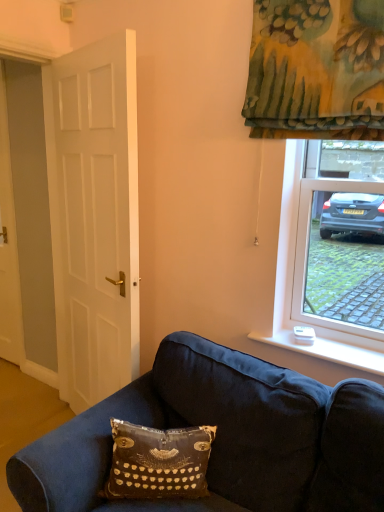
Find the location of a particular element. This screenshot has width=384, height=512. white wood door at left, the first door when ordered from left to right is located at coordinates (8, 246).

The height and width of the screenshot is (512, 384). I want to click on white matte door at left, which appears as the 2th door when viewed from the back, so click(x=94, y=216).

In order to click on velvety black pillow with typewriter design at lower center in this screenshot , I will do `click(158, 462)`.

The width and height of the screenshot is (384, 512). In order to click on white wood door at left, marked as the 2th door in a right-to-left arrangement in this screenshot , I will do `click(8, 246)`.

Considering the relative sizes of white wood door at left, the first door when ordered from left to right, and white matte door at left, the 1th door positioned from the front, in the image provided, is white wood door at left, the first door when ordered from left to right, shorter than white matte door at left, the 1th door positioned from the front,?

Indeed, white wood door at left, the first door when ordered from left to right, has a lesser height compared to white matte door at left, the 1th door positioned from the front.

Based on the photo, does white wood door at left, the first door when ordered from left to right, touch white matte door at left, positioned as the first door in right-to-left order?

No.

Is white wood door at left, the first door when ordered from left to right, to the left or to the right of white matte door at left, the 1th door positioned from the front, in the image?

white wood door at left, the first door when ordered from left to right, is positioned on white matte door at left, the 1th door positioned from the front,'s left side.

What's the angular difference between white wood door at left, the 1th door viewed from the back, and white matte door at left, positioned as the first door in right-to-left order,'s facing directions?

The angle between the facing direction of white wood door at left, the 1th door viewed from the back, and the facing direction of white matte door at left, positioned as the first door in right-to-left order, is 15.2 degrees.

Is white plastic remote control at lower right to the left of white matte door at left, the 1th door positioned from the front, from the viewer's perspective?

No.

Would you say white plastic remote control at lower right contains white matte door at left, positioned as the first door in right-to-left order?

Actually, white matte door at left, positioned as the first door in right-to-left order, is outside white plastic remote control at lower right.

From a real-world perspective, is white plastic remote control at lower right beneath white matte door at left, the 2th door positioned from the left?

Yes, from a real-world perspective, white plastic remote control at lower right is under white matte door at left, the 2th door positioned from the left.

Does white matte door at left, the 2th door positioned from the left, contain white plastic remote control at lower right?

No.

From the image's perspective, which is below, white matte door at left, the 2th door positioned from the left, or white plastic remote control at lower right?

white plastic remote control at lower right.

Who is shorter, white matte door at left, the 2th door positioned from the left, or white plastic remote control at lower right?

With less height is white plastic remote control at lower right.

Where is `window sill below the white matte door at left, the 1th door positioned from the front (from the image's perspective)`? window sill below the white matte door at left, the 1th door positioned from the front (from the image's perspective) is located at coordinates (327, 350).

How different are the orientations of white wood door at left, marked as the 2th door in a right-to-left arrangement, and white plastic remote control at lower right in degrees?

2.55 degrees separate the facing orientations of white wood door at left, marked as the 2th door in a right-to-left arrangement, and white plastic remote control at lower right.

Is white wood door at left, the first door when ordered from left to right, facing towards white plastic remote control at lower right?

No, white wood door at left, the first door when ordered from left to right, is not aimed at white plastic remote control at lower right.

From a real-world perspective, starting from the white plastic remote control at lower right, which door is the 1st one vertically above it? Please provide its 2D coordinates.

[(8, 246)]

From the image's perspective, is white wood door at left, the second door when ordered from front to back, located above white plastic remote control at lower right?

Indeed, from the image's perspective, white wood door at left, the second door when ordered from front to back, is shown above white plastic remote control at lower right.

Choose the correct answer: Is velvety black pillow with typewriter design at lower center inside white matte door at left, the 2th door positioned from the left, or outside it?

velvety black pillow with typewriter design at lower center is outside white matte door at left, the 2th door positioned from the left.

Which object is more forward, velvety black pillow with typewriter design at lower center or white matte door at left, positioned as the first door in right-to-left order?

velvety black pillow with typewriter design at lower center.

Is velvety black pillow with typewriter design at lower center shorter than white matte door at left, which appears as the 2th door when viewed from the back?

Indeed, velvety black pillow with typewriter design at lower center has a lesser height compared to white matte door at left, which appears as the 2th door when viewed from the back.

From the image's perspective, between white matte door at left, positioned as the first door in right-to-left order, and velvety black pillow with typewriter design at lower center, which one is located above?

white matte door at left, positioned as the first door in right-to-left order, is shown above in the image.

Is white matte door at left, the 2th door positioned from the left, looking in the opposite direction of velvety black pillow with typewriter design at lower center?

No, white matte door at left, the 2th door positioned from the left, is not facing the opposite direction of velvety black pillow with typewriter design at lower center.

From their relative heights in the image, would you say white matte door at left, positioned as the first door in right-to-left order, is taller or shorter than velvety black pillow with typewriter design at lower center?

Considering their sizes, white matte door at left, positioned as the first door in right-to-left order, has more height than velvety black pillow with typewriter design at lower center.

Considering the positions of objects white matte door at left, the 1th door positioned from the front, and velvety black pillow with typewriter design at lower center in the image provided, who is more to the right, white matte door at left, the 1th door positioned from the front, or velvety black pillow with typewriter design at lower center?

From the viewer's perspective, velvety black pillow with typewriter design at lower center appears more on the right side.

From the image's perspective, is velvety black pillow with typewriter design at lower center on top of white plastic remote control at lower right?

Incorrect, from the image's perspective, velvety black pillow with typewriter design at lower center is lower than white plastic remote control at lower right.

Considering the sizes of objects velvety black pillow with typewriter design at lower center and white plastic remote control at lower right in the image provided, who is bigger, velvety black pillow with typewriter design at lower center or white plastic remote control at lower right?

velvety black pillow with typewriter design at lower center.

Which is closer to the camera, (147, 462) or (339, 356)?

Point (147, 462) is positioned closer to the camera compared to point (339, 356).

Locate an element on the screen. The height and width of the screenshot is (512, 384). pillow in front of the white plastic remote control at lower right is located at coordinates (158, 462).

Find the location of a particular element. This screenshot has height=512, width=384. door below the white matte door at left, the 1th door positioned from the front (from a real-world perspective) is located at coordinates (8, 246).

I want to click on the 1st door to the left of the white plastic remote control at lower right, starting your count from the anchor, so click(94, 216).

Consider the image. Which object lies further to the anchor point velvety black pillow with typewriter design at lower center, white plastic remote control at lower right or white matte door at left, the 1th door positioned from the front?

Among the two, white matte door at left, the 1th door positioned from the front, is located further to velvety black pillow with typewriter design at lower center.

Which object lies further to the anchor point velvety black pillow with typewriter design at lower center, white wood door at left, the second door when ordered from front to back, or white matte door at left, which appears as the 2th door when viewed from the back?

white wood door at left, the second door when ordered from front to back, lies further to velvety black pillow with typewriter design at lower center than the other object.

Considering their positions, is white wood door at left, the first door when ordered from left to right, positioned closer to white plastic remote control at lower right than white matte door at left, the 1th door positioned from the front?

white matte door at left, the 1th door positioned from the front, is closer to white plastic remote control at lower right.

Considering their positions, is velvety black pillow with typewriter design at lower center positioned further to white matte door at left, positioned as the first door in right-to-left order, than white plastic remote control at lower right?

The object further to white matte door at left, positioned as the first door in right-to-left order, is white plastic remote control at lower right.

Estimate the real-world distances between objects in this image. Which object is further from white wood door at left, marked as the 2th door in a right-to-left arrangement, white matte door at left, the 1th door positioned from the front, or velvety black pillow with typewriter design at lower center?

Based on the image, velvety black pillow with typewriter design at lower center appears to be further to white wood door at left, marked as the 2th door in a right-to-left arrangement.

Looking at this image, looking at the image, which one is located further to white plastic remote control at lower right, white matte door at left, the 2th door positioned from the left, or white wood door at left, the first door when ordered from left to right?

The object further to white plastic remote control at lower right is white wood door at left, the first door when ordered from left to right.

Based on their spatial positions, is white plastic remote control at lower right or white matte door at left, positioned as the first door in right-to-left order, closer to white wood door at left, marked as the 2th door in a right-to-left arrangement?

white matte door at left, positioned as the first door in right-to-left order, is positioned closer to the anchor white wood door at left, marked as the 2th door in a right-to-left arrangement.

Which object lies nearer to the anchor point white wood door at left, marked as the 2th door in a right-to-left arrangement, velvety black pillow with typewriter design at lower center or white matte door at left, positioned as the first door in right-to-left order?

white matte door at left, positioned as the first door in right-to-left order, lies closer to white wood door at left, marked as the 2th door in a right-to-left arrangement, than the other object.

Locate an element on the screen. This screenshot has height=512, width=384. door positioned between velvety black pillow with typewriter design at lower center and white wood door at left, the 1th door viewed from the back, from near to far is located at coordinates (94, 216).

Find the location of a particular element. The width and height of the screenshot is (384, 512). pillow between white wood door at left, the first door when ordered from left to right, and white plastic remote control at lower right is located at coordinates (158, 462).

I want to click on pillow between white matte door at left, which appears as the 2th door when viewed from the back, and white plastic remote control at lower right, so pos(158,462).

Where is `door located between white wood door at left, the first door when ordered from left to right, and white plastic remote control at lower right in the left-right direction`? door located between white wood door at left, the first door when ordered from left to right, and white plastic remote control at lower right in the left-right direction is located at coordinates (94, 216).